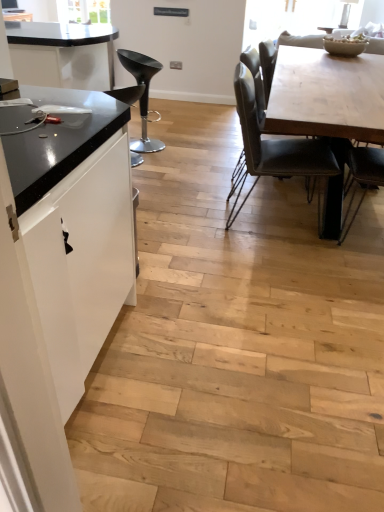
Question: Is black leather bar stool at left, placed as the 1th chair when sorted from left to right, bigger or smaller than white matte cabinet at left?

Choices:
 (A) small
 (B) big

Answer: (A)

Question: Would you say black leather bar stool at left, marked as the third chair in a right-to-left arrangement, is to the left or to the right of white matte cabinet at left in the picture?

Choices:
 (A) left
 (B) right

Answer: (A)

Question: Based on their relative distances, which object is farther from the black plastic stool at left, the 2th chair viewed from the left?

Choices:
 (A) white matte cabinet at left
 (B) leatherette chair at center, the 3th chair viewed from the left
 (C) light wood table at center
 (D) black leather bar stool at left, marked as the third chair in a right-to-left arrangement

Answer: (A)

Question: Estimate the real-world distances between objects in this image. Which object is farther from the black leather bar stool at left, placed as the 1th chair when sorted from left to right?

Choices:
 (A) white matte cabinet at left
 (B) black plastic stool at left, the 2th chair viewed from the left
 (C) leatherette chair at center, the 1th chair when ordered from right to left
 (D) light wood table at center

Answer: (A)